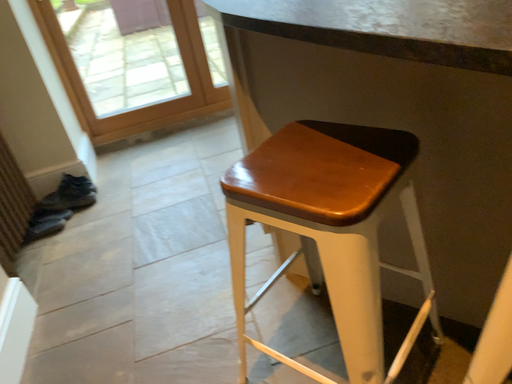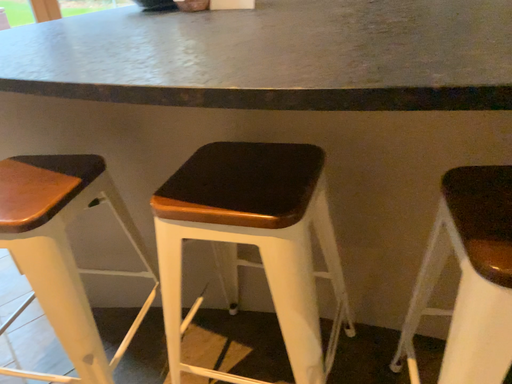
Question: How did the camera likely rotate when shooting the video?

Choices:
 (A) rotated right
 (B) rotated left

Answer: (A)